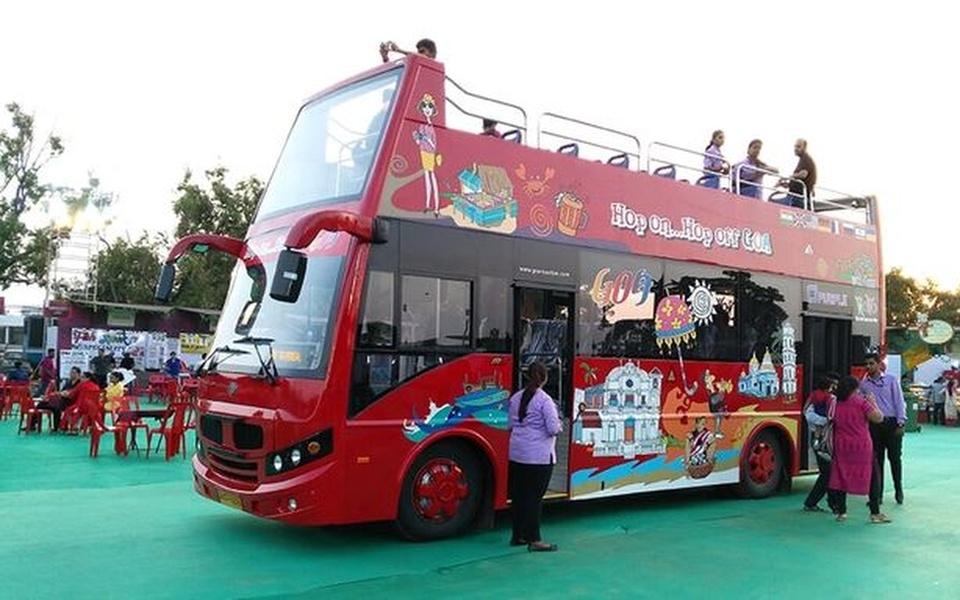
Where is `red chairs`? The image size is (960, 600). red chairs is located at coordinates (165, 433), (99, 429).